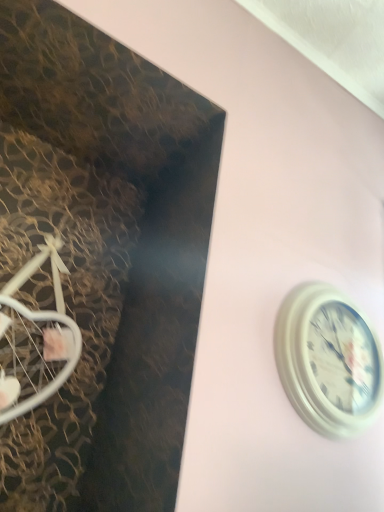
The height and width of the screenshot is (512, 384). What do you see at coordinates (328, 360) in the screenshot?
I see `white glossy wall clock at right` at bounding box center [328, 360].

What are the coordinates of `white glossy wall clock at right` in the screenshot? It's located at (328, 360).

The height and width of the screenshot is (512, 384). What are the coordinates of `white glossy wall clock at right` in the screenshot? It's located at (328, 360).